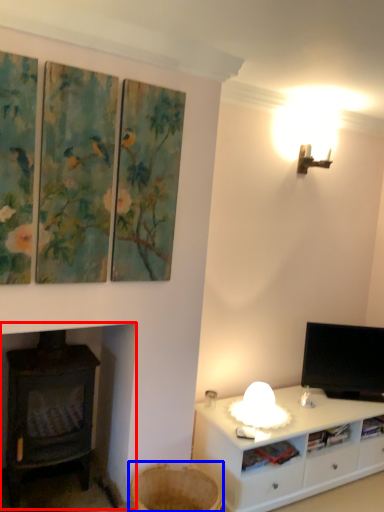
Question: Which of the following is the closest to the observer, wood burning stove (highlighted by a red box) or basket (highlighted by a blue box)?

Choices:
 (A) wood burning stove
 (B) basket

Answer: (B)